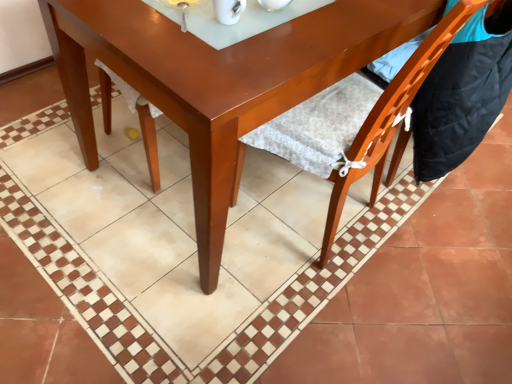
Question: Do you think wooden chair at lower right, arranged as the first chair when viewed from the left, is within glossy wood table at center, or outside of it?

Choices:
 (A) outside
 (B) inside

Answer: (B)

Question: Looking at their shapes, would you say wooden chair at lower right, positioned as the second chair in right-to-left order, is wider or thinner than glossy wood table at center?

Choices:
 (A) wide
 (B) thin

Answer: (B)

Question: Estimate the real-world distances between objects in this image. Which object is closer to the glossy wood table at center?

Choices:
 (A) orange wood chair at lower right, which is the first chair from right to left
 (B) wooden chair at lower right, arranged as the first chair when viewed from the left

Answer: (B)

Question: Which is farther from the glossy wood table at center?

Choices:
 (A) wooden chair at lower right, arranged as the first chair when viewed from the left
 (B) orange wood chair at lower right, which is the first chair from right to left

Answer: (B)